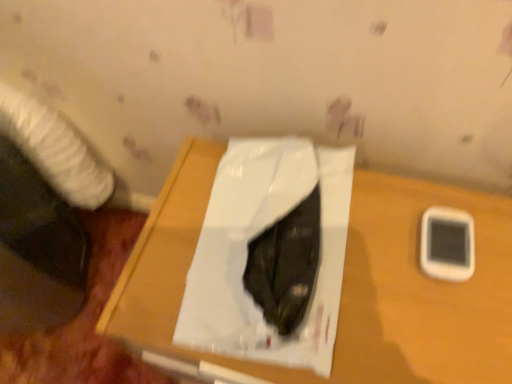
At what (x,y) coordinates should I click in order to perform the action: click on blank space to the left of white plastic mobile phone at right. Please return your answer as a coordinate pair (x, y). This screenshot has height=384, width=512. Looking at the image, I should click on (352, 266).